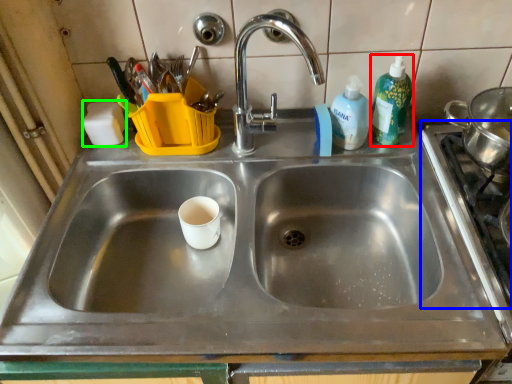
Question: Which is farther away from cleaning product (highlighted by a red box)? gas stove (highlighted by a blue box) or soap (highlighted by a green box)?

Choices:
 (A) gas stove
 (B) soap

Answer: (B)